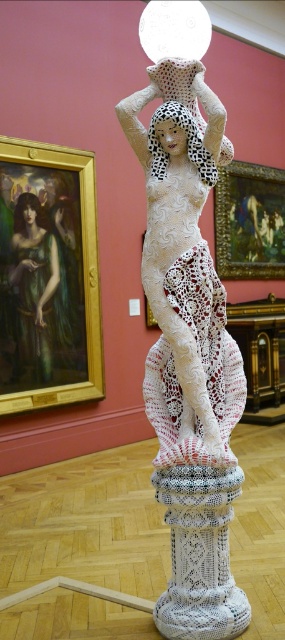
Does green glossy dress at upper left appear under dalmatian-patterned fabric head at center?

Yes.

Is green glossy dress at upper left to the left of dalmatian-patterned fabric head at center from the viewer's perspective?

Correct, you'll find green glossy dress at upper left to the left of dalmatian-patterned fabric head at center.

Is point (17, 272) more distant than point (192, 120)?

Yes, it is behind point (192, 120).

I want to click on green glossy dress at upper left, so click(x=39, y=294).

Between white crocheted doll at center and white crochet dress at center, which one has less height?

white crochet dress at center is shorter.

Which is below, white crocheted doll at center or white crochet dress at center?

white crochet dress at center is lower down.

Between point (204, 68) and point (202, 348), which one is positioned behind?

Positioned behind is point (202, 348).

You are a GUI agent. You are given a task and a screenshot of the screen. Output one action in this format:
    pyautogui.click(x=<x>, y=<y>)
    Task: Click on the white crocheted doll at center
    The height and width of the screenshot is (640, 285).
    Given the screenshot: What is the action you would take?
    pyautogui.click(x=184, y=282)

Does white knitted pillar at center come in front of dalmatian-patterned fabric head at center?

Yes, it is.

You are a GUI agent. You are given a task and a screenshot of the screen. Output one action in this format:
    pyautogui.click(x=<x>, y=<y>)
    Task: Click on the white knitted pillar at center
    Image resolution: width=285 pixels, height=640 pixels.
    Given the screenshot: What is the action you would take?
    pyautogui.click(x=200, y=554)

Where is `white knitted pillar at center`? Image resolution: width=285 pixels, height=640 pixels. white knitted pillar at center is located at coordinates (200, 554).